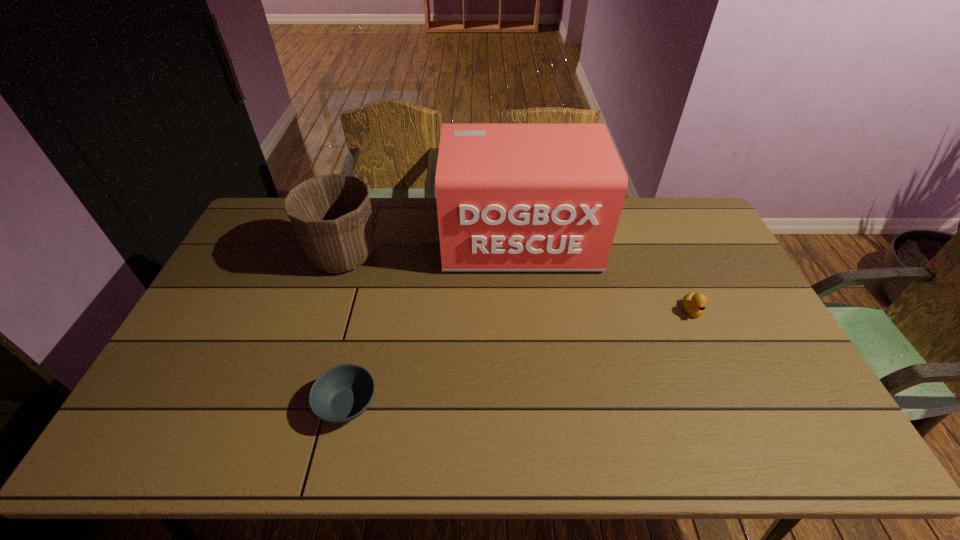
This screenshot has width=960, height=540. I want to click on unoccupied area between the shortest object and the box, so coord(434,322).

Image resolution: width=960 pixels, height=540 pixels. Find the location of `free space between the shortest object and the second shortest object`. free space between the shortest object and the second shortest object is located at coordinates (519, 357).

This screenshot has height=540, width=960. What are the coordinates of `free spot between the tallest object and the flowerpot` in the screenshot? It's located at (432, 247).

The height and width of the screenshot is (540, 960). I want to click on empty location between the soup bowl and the flowerpot, so click(346, 329).

Locate an element on the screen. vacant area that lies between the third shortest object and the second shortest object is located at coordinates (517, 283).

You are a GUI agent. You are given a task and a screenshot of the screen. Output one action in this format:
    pyautogui.click(x=<x>, y=<y>)
    Task: Click on the free point between the second tallest object and the rightmost object
    The height and width of the screenshot is (540, 960).
    Given the screenshot: What is the action you would take?
    pyautogui.click(x=517, y=283)

Where is `unoccupied area between the flowerpot and the tallest object`? The image size is (960, 540). unoccupied area between the flowerpot and the tallest object is located at coordinates (432, 247).

At what (x,y) coordinates should I click in order to perform the action: click on vacant area that lies between the box and the second nearest object. Please return your answer as a coordinate pair (x, y). Looking at the image, I should click on [x=606, y=275].

Where is `free space between the nearest object and the third tallest object`? Image resolution: width=960 pixels, height=540 pixels. free space between the nearest object and the third tallest object is located at coordinates (519, 357).

You are a GUI agent. You are given a task and a screenshot of the screen. Output one action in this format:
    pyautogui.click(x=<x>, y=<y>)
    Task: Click on the closest object to the flowerpot
    
    Given the screenshot: What is the action you would take?
    pyautogui.click(x=510, y=196)